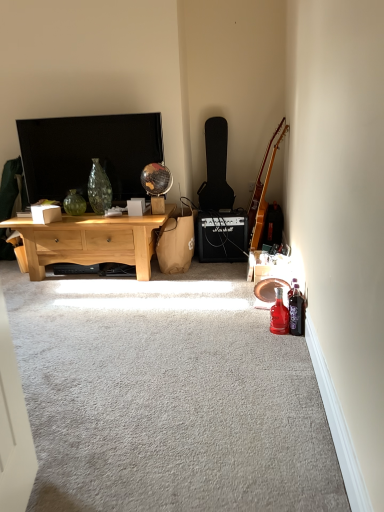
Describe the element at coordinates (46, 214) in the screenshot. I see `white cardboard box at center, the 2th box viewed from the right` at that location.

Measure the distance between point (54, 211) and camera.

Point (54, 211) is 9.41 feet away from camera.

The image size is (384, 512). Describe the element at coordinates (279, 314) in the screenshot. I see `translucent glass bottle at lower right, which ranks as the second bottle in right-to-left order` at that location.

At what (x,y) coordinates should I click in order to perform the action: click on glossy wood guitar at right, which is the first guitar from front to back. Please return your answer as a coordinate pair (x, y). The image size is (384, 512). Looking at the image, I should click on (262, 191).

The height and width of the screenshot is (512, 384). What do you see at coordinates (222, 236) in the screenshot? I see `black matte amplifier at center` at bounding box center [222, 236].

Measure the distance between point (x=219, y=182) and camera.

Point (x=219, y=182) and camera are 11.45 feet apart from each other.

The height and width of the screenshot is (512, 384). Describe the element at coordinates (269, 289) in the screenshot. I see `metallic silver mechanical fan at lower right` at that location.

You are a GUI agent. You are given a task and a screenshot of the screen. Output one action in this format:
    pyautogui.click(x=<x>, y=<y>)
    Task: Click on the green glass vase at center
    This screenshot has width=384, height=512.
    Given the screenshot: What is the action you would take?
    pyautogui.click(x=74, y=203)

Where is `white cardboard box at center, the first box in the left-to-right sequence`? The width and height of the screenshot is (384, 512). white cardboard box at center, the first box in the left-to-right sequence is located at coordinates (46, 214).

From the picture: Would you consider translucent purple bottle at lower right, which is counted as the 1th bottle, starting from the right, to be distant from black matte amplifier at center?

That's right, there is a large distance between translucent purple bottle at lower right, which is counted as the 1th bottle, starting from the right, and black matte amplifier at center.

Between point (299, 293) and point (219, 249), which one is positioned in front?

The point (299, 293) is closer.

Can you confirm if translucent purple bottle at lower right, which is counted as the 1th bottle, starting from the right, is wider than black matte amplifier at center?

No, translucent purple bottle at lower right, which is counted as the 1th bottle, starting from the right, is not wider than black matte amplifier at center.

Is translucent purple bottle at lower right, which is counted as the 1th bottle, starting from the right, shorter than black matte amplifier at center?

Indeed, translucent purple bottle at lower right, which is counted as the 1th bottle, starting from the right, has a lesser height compared to black matte amplifier at center.

What's the angular difference between light wood/finish tv stand at left and brown paper bag at center's facing directions?

The angular difference between light wood/finish tv stand at left and brown paper bag at center is 86.4 degrees.

Considering the positions of objects light wood/finish tv stand at left and brown paper bag at center in the image provided, who is in front, light wood/finish tv stand at left or brown paper bag at center?

light wood/finish tv stand at left is more forward.

Can you confirm if light wood/finish tv stand at left is wider than brown paper bag at center?

Yes, light wood/finish tv stand at left is wider than brown paper bag at center.

Where is `desk below the brown paper bag at center (from the image's perspective)`? desk below the brown paper bag at center (from the image's perspective) is located at coordinates (x=90, y=241).

Is point (149, 114) behind point (260, 226)?

Yes, it is behind point (260, 226).

Can you confirm if matte black tv at upper left is positioned to the right of glossy wood guitar at right, which is the 2th guitar in back-to-front order?

Incorrect, matte black tv at upper left is not on the right side of glossy wood guitar at right, which is the 2th guitar in back-to-front order.

Looking at this image, would you say matte black tv at upper left is a long distance from glossy wood guitar at right, which is the first guitar from right to left?

Yes.

From a real-world perspective, is matte black tv at upper left positioned over glossy wood guitar at right, which is the 2th guitar in back-to-front order, based on gravity?

Indeed, from a real-world perspective, matte black tv at upper left stands above glossy wood guitar at right, which is the 2th guitar in back-to-front order.

What's the angular difference between green glass vase at center and white cardboard box at center, the 2th box viewed from the right,'s facing directions?

There is a 38.8-degree angle between the facing directions of green glass vase at center and white cardboard box at center, the 2th box viewed from the right.

Between point (67, 204) and point (53, 211), which one is positioned behind?

The point (67, 204) is more distant.

Is green glass vase at center to the left or to the right of white cardboard box at center, the first box in the left-to-right sequence, in the image?

green glass vase at center is positioned on white cardboard box at center, the first box in the left-to-right sequence,'s right side.

Considering the sizes of objects green glass vase at center and white cardboard box at center, the first box in the left-to-right sequence, in the image provided, who is thinner, green glass vase at center or white cardboard box at center, the first box in the left-to-right sequence,?

white cardboard box at center, the first box in the left-to-right sequence, is thinner.

How many degrees apart are the facing directions of white cardboard box at center, the first box in the left-to-right sequence, and light wood/finish tv stand at left?

There is a 38-degree angle between the facing directions of white cardboard box at center, the first box in the left-to-right sequence, and light wood/finish tv stand at left.

Where is `the 1st box above the light wood/finish tv stand at left (from the image's perspective)`? The height and width of the screenshot is (512, 384). the 1st box above the light wood/finish tv stand at left (from the image's perspective) is located at coordinates (46, 214).

Considering the positions of objects white cardboard box at center, the 2th box viewed from the right, and light wood/finish tv stand at left in the image provided, who is more to the left, white cardboard box at center, the 2th box viewed from the right, or light wood/finish tv stand at left?

From the viewer's perspective, white cardboard box at center, the 2th box viewed from the right, appears more on the left side.

Considering the relative sizes of white cardboard box at center, the first box in the left-to-right sequence, and light wood/finish tv stand at left in the image provided, is white cardboard box at center, the first box in the left-to-right sequence, smaller than light wood/finish tv stand at left?

Yes, white cardboard box at center, the first box in the left-to-right sequence, is smaller than light wood/finish tv stand at left.

From the image's perspective, which object appears higher, light wood/finish tv stand at left or black matte amplifier at center?

black matte amplifier at center.

Where is `loudspeaker below the light wood/finish tv stand at left (from a real-world perspective)`? Image resolution: width=384 pixels, height=512 pixels. loudspeaker below the light wood/finish tv stand at left (from a real-world perspective) is located at coordinates (222, 236).

Is light wood/finish tv stand at left positioned with its back to black matte amplifier at center?

That's not correct — light wood/finish tv stand at left is not looking away from black matte amplifier at center.

Is light wood/finish tv stand at left to the right of black matte amplifier at center from the viewer's perspective?

No, light wood/finish tv stand at left is not to the right of black matte amplifier at center.

From the image's perspective, is green glass vase at center located above or below black matte guitar case at center-right, the second guitar in the right-to-left sequence?

green glass vase at center is below black matte guitar case at center-right, the second guitar in the right-to-left sequence.

Is there a large distance between green glass vase at center and black matte guitar case at center-right, the second guitar in the right-to-left sequence?

Yes, green glass vase at center is far from black matte guitar case at center-right, the second guitar in the right-to-left sequence.

Is green glass vase at center aimed at black matte guitar case at center-right, which is counted as the first guitar, starting from the back?

No, green glass vase at center is not oriented towards black matte guitar case at center-right, which is counted as the first guitar, starting from the back.

In the scene shown: Is green glass vase at center wider or thinner than black matte guitar case at center-right, arranged as the 1th guitar when viewed from the left?

green glass vase at center is thinner than black matte guitar case at center-right, arranged as the 1th guitar when viewed from the left.

The width and height of the screenshot is (384, 512). Identify the location of loudspeaker above the translucent purple bottle at lower right, which is counted as the 1th bottle, starting from the right (from the image's perspective). (222, 236).

Locate an element on the screen. desk that appears above the brown paper bag at center (from a real-world perspective) is located at coordinates (90, 241).

Which object lies further to the anchor point translucent glass bottle at lower right, arranged as the 1th bottle when viewed from the left, white matte box at center, which is counted as the first box, starting from the right, or green glass vase at center?

The object further to translucent glass bottle at lower right, arranged as the 1th bottle when viewed from the left, is green glass vase at center.

Which object lies further to the anchor point translucent glass bottle at lower right, which ranks as the second bottle in right-to-left order, matte black tv at upper left or black matte amplifier at center?

matte black tv at upper left is further to translucent glass bottle at lower right, which ranks as the second bottle in right-to-left order.

Estimate the real-world distances between objects in this image. Which object is closer to matte black tv at upper left, white matte box at center, which is counted as the first box, starting from the right, or brown paper bag at center?

white matte box at center, which is counted as the first box, starting from the right, lies closer to matte black tv at upper left than the other object.

Looking at the image, which one is located closer to translucent purple bottle at lower right, the 2th bottle when ordered from left to right, translucent glass bottle at lower right, which ranks as the second bottle in right-to-left order, or brown paper bag at center?

Based on the image, translucent glass bottle at lower right, which ranks as the second bottle in right-to-left order, appears to be nearer to translucent purple bottle at lower right, the 2th bottle when ordered from left to right.

Looking at the image, which one is located further to glossy wood guitar at right, which is the first guitar from front to back, translucent purple bottle at lower right, the 2th bottle when ordered from left to right, or black matte guitar case at center-right, which appears as the 2th guitar when viewed from the front?

The object further to glossy wood guitar at right, which is the first guitar from front to back, is translucent purple bottle at lower right, the 2th bottle when ordered from left to right.

When comparing their distances from white cardboard box at center, the 2th box viewed from the right, does black matte amplifier at center or translucent purple bottle at lower right, which is counted as the 1th bottle, starting from the right, seem closer?

black matte amplifier at center lies closer to white cardboard box at center, the 2th box viewed from the right, than the other object.

Which object lies nearer to the anchor point black matte amplifier at center, matte black tv at upper left or translucent purple bottle at lower right, which is counted as the 1th bottle, starting from the right?

Among the two, matte black tv at upper left is located nearer to black matte amplifier at center.

From the image, which object appears to be nearer to black matte guitar case at center-right, the second guitar in the right-to-left sequence, brown paper bag at center or translucent glass bottle at lower right, which ranks as the second bottle in right-to-left order?

brown paper bag at center lies closer to black matte guitar case at center-right, the second guitar in the right-to-left sequence, than the other object.

Locate an element on the screen. The height and width of the screenshot is (512, 384). guitar located between white cardboard box at center, the first box in the left-to-right sequence, and metallic silver mechanical fan at lower right in the left-right direction is located at coordinates tap(216, 168).

What are the coordinates of `box between green glass vase at center and translucent glass bottle at lower right, which ranks as the second bottle in right-to-left order` in the screenshot? It's located at (136, 206).

The height and width of the screenshot is (512, 384). I want to click on mechanical fan located between white matte box at center, acting as the 2th box starting from the left, and translucent purple bottle at lower right, which is counted as the 1th bottle, starting from the right, in the left-right direction, so click(269, 289).

Identify the location of mechanical fan between white matte box at center, acting as the 2th box starting from the left, and glossy wood guitar at right, which is counted as the 2th guitar, starting from the left. (269, 289).